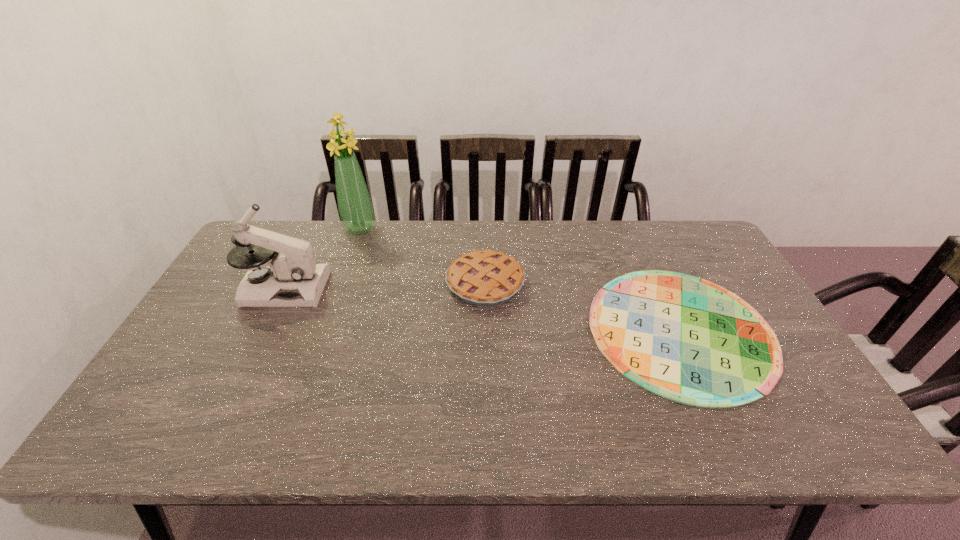
Locate an element on the screen. object that is the third closest to the microscope is located at coordinates (686, 339).

Where is `vacant region that satisfies the following two spatial constraints: 1. at the eyepiece of the second tallest object; 2. on the left side of the shortest object`? This screenshot has width=960, height=540. vacant region that satisfies the following two spatial constraints: 1. at the eyepiece of the second tallest object; 2. on the left side of the shortest object is located at coordinates (264, 329).

You are a GUI agent. You are given a task and a screenshot of the screen. Output one action in this format:
    pyautogui.click(x=<x>, y=<y>)
    Task: Click on the free location that satisfies the following two spatial constraints: 1. on the front-facing side of the second shortest object; 2. on the left side of the tallest object
    This screenshot has height=540, width=960.
    Given the screenshot: What is the action you would take?
    pyautogui.click(x=341, y=284)

Find the location of a particular element. The image size is (960, 540). vacant space that satisfies the following two spatial constraints: 1. at the eyepiece of the rightmost object; 2. on the left side of the microscope is located at coordinates (264, 329).

Where is `vacant region that satisfies the following two spatial constraints: 1. on the front-facing side of the tallest object; 2. at the eyepiece of the microscope`? vacant region that satisfies the following two spatial constraints: 1. on the front-facing side of the tallest object; 2. at the eyepiece of the microscope is located at coordinates (339, 288).

You are a GUI agent. You are given a task and a screenshot of the screen. Output one action in this format:
    pyautogui.click(x=<x>, y=<y>)
    Task: Click on the free region that satisfies the following two spatial constraints: 1. on the front-facing side of the bouquet; 2. at the eyepiece of the second tallest object
    The height and width of the screenshot is (540, 960).
    Given the screenshot: What is the action you would take?
    pyautogui.click(x=339, y=288)

Find the location of a particular element. The width and height of the screenshot is (960, 540). free location that satisfies the following two spatial constraints: 1. on the back side of the gameboard; 2. at the eyepiece of the microscope is located at coordinates (661, 288).

At what (x,y) coordinates should I click in order to perform the action: click on free space that satisfies the following two spatial constraints: 1. at the eyepiece of the second tallest object; 2. on the right side of the gameboard. Please return your answer as a coordinate pair (x, y). This screenshot has width=960, height=540. Looking at the image, I should click on (264, 329).

Where is `vacant region that satisfies the following two spatial constraints: 1. on the front-facing side of the farthest object; 2. on the left side of the second object from right to left`? The width and height of the screenshot is (960, 540). vacant region that satisfies the following two spatial constraints: 1. on the front-facing side of the farthest object; 2. on the left side of the second object from right to left is located at coordinates (341, 284).